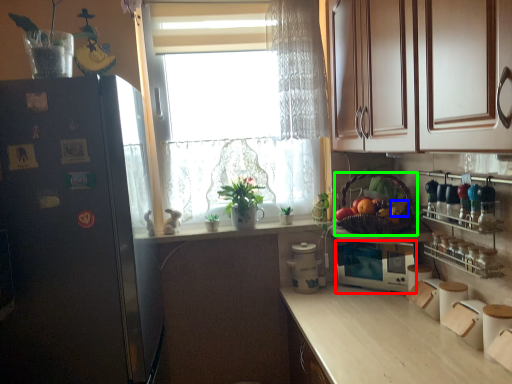
Question: Estimate the real-world distances between objects in this image. Which object is closer to appliance (highlighted by a red box), fruit (highlighted by a blue box) or basket (highlighted by a green box)?

Choices:
 (A) fruit
 (B) basket

Answer: (B)